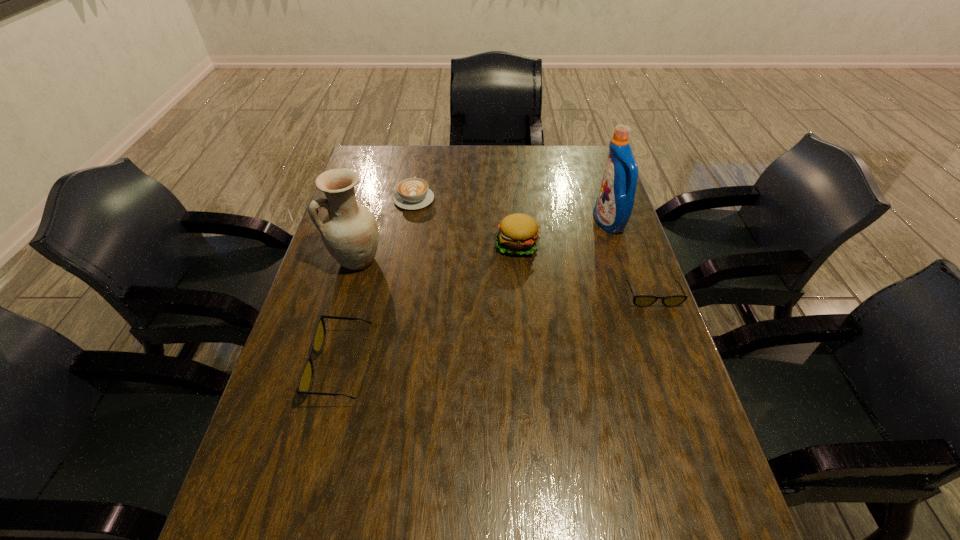
Where is `detergent at the right edge`? This screenshot has width=960, height=540. detergent at the right edge is located at coordinates (614, 204).

In order to click on vacant position at the far edge of the desktop in this screenshot , I will do [512, 171].

The width and height of the screenshot is (960, 540). In the image, there is a desktop. In order to click on vacant space at the near edge in this screenshot , I will do `click(417, 477)`.

What are the coordinates of `free space at the left edge` in the screenshot? It's located at (277, 412).

Where is `free point at the right edge`? The width and height of the screenshot is (960, 540). free point at the right edge is located at coordinates (597, 189).

Locate an element on the screen. This screenshot has width=960, height=540. free space at the far left corner of the desktop is located at coordinates (386, 161).

In the image, there is a desktop. Where is `vacant space at the far right corner`? The image size is (960, 540). vacant space at the far right corner is located at coordinates (591, 174).

Locate an element on the screen. vacant space at the near right corner of the desktop is located at coordinates (714, 498).

The height and width of the screenshot is (540, 960). In order to click on vacant area between the cappuccino and the third object from right to left in this screenshot , I will do `click(466, 221)`.

This screenshot has width=960, height=540. Identify the location of vacant space in between the pottery and the cappuccino. (385, 230).